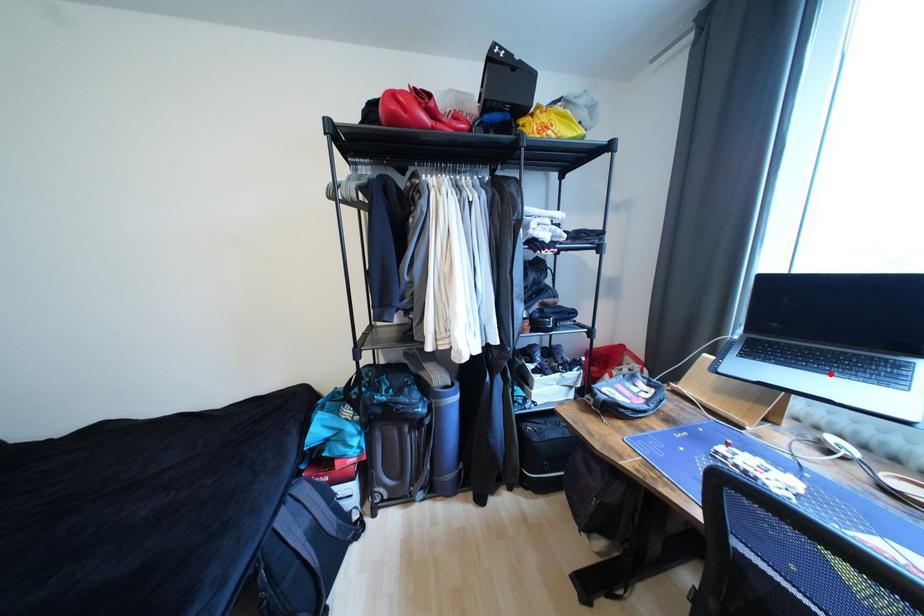
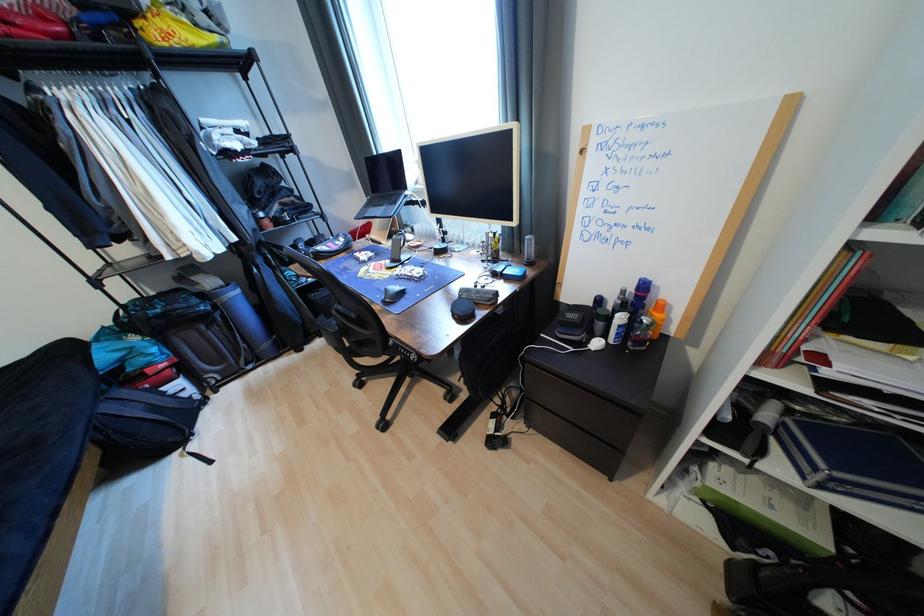
Question: I am providing you with two images of the same scene from different viewpoints. Given a red point in image1, look at the same physical point in image2. Is it:

Choices:
 (A) Closer to the viewpoint
 (B) Farther from the viewpoint

Answer: (A)